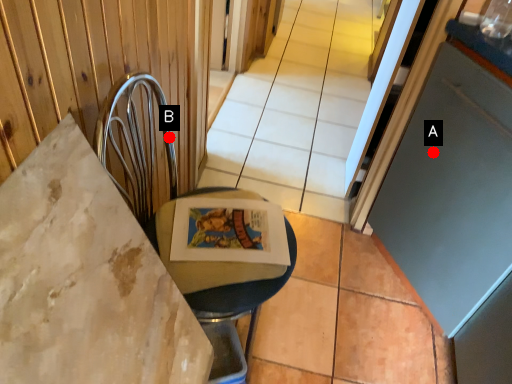
Question: Two points are circled on the image, labeled by A and B beside each circle. Which point is farther to the camera?

Choices:
 (A) A is further
 (B) B is further

Answer: (A)